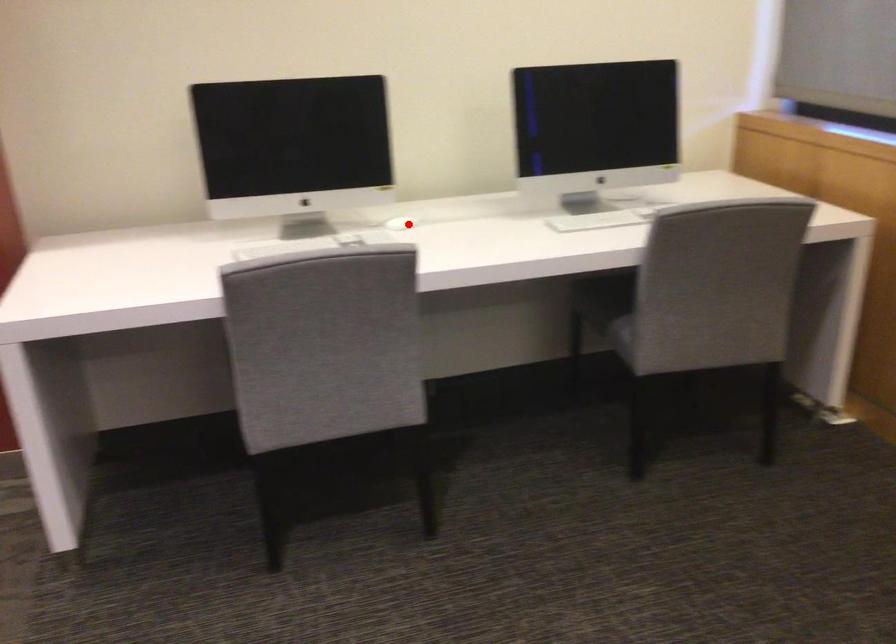
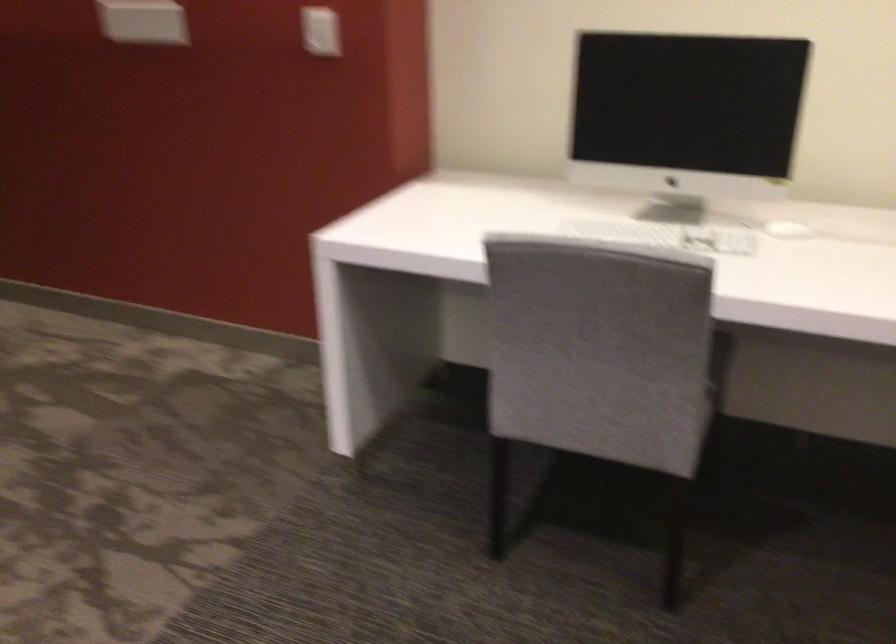
Question: I am providing you with two images of the same scene from different viewpoints. Given a red point in image1, look at the same physical point in image2. Is it:

Choices:
 (A) Closer to the viewpoint
 (B) Farther from the viewpoint

Answer: (A)